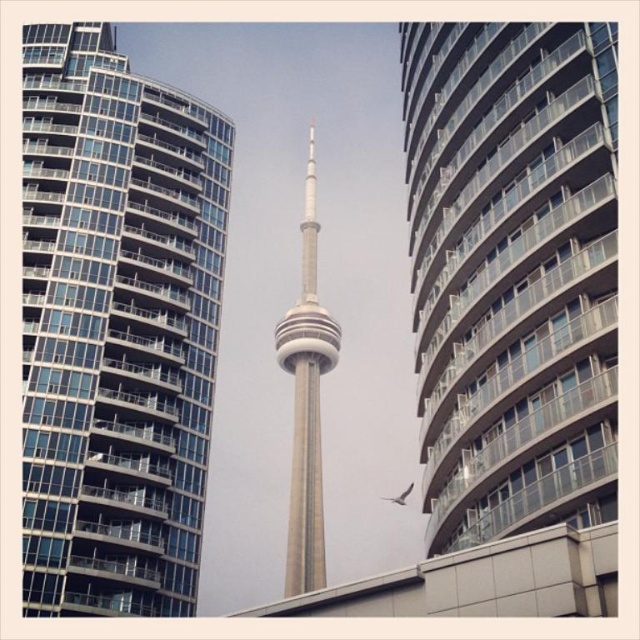
You are standing at a viewpoint where you can see both the glassy steel building at left and the smooth glass building at center. Which building is closer to you?

The glassy steel building at left is closer to you because the smooth glass building at center is positioned behind it.

You are an architect evaluating the urban layout. Based on the scene, which of the two central structures, the smooth glass building at center or the gray concrete tower at center, has a more compact footprint? Please justify your answer using the provided information.

The smooth glass building at center has a smaller size compared to the gray concrete tower at center, indicating it has a more compact footprint.

You are a drone operator who needs to fly a drone from the glassy steel building at left to the gray concrete tower at center. The drone has a maximum range of 60 meters. Can the drone reach the tower?

The glassy steel building at left is 61.86 meters from gray concrete tower at center. Since the distance exceeds the drone maximum range of 60 meters, the drone cannot reach the tower.